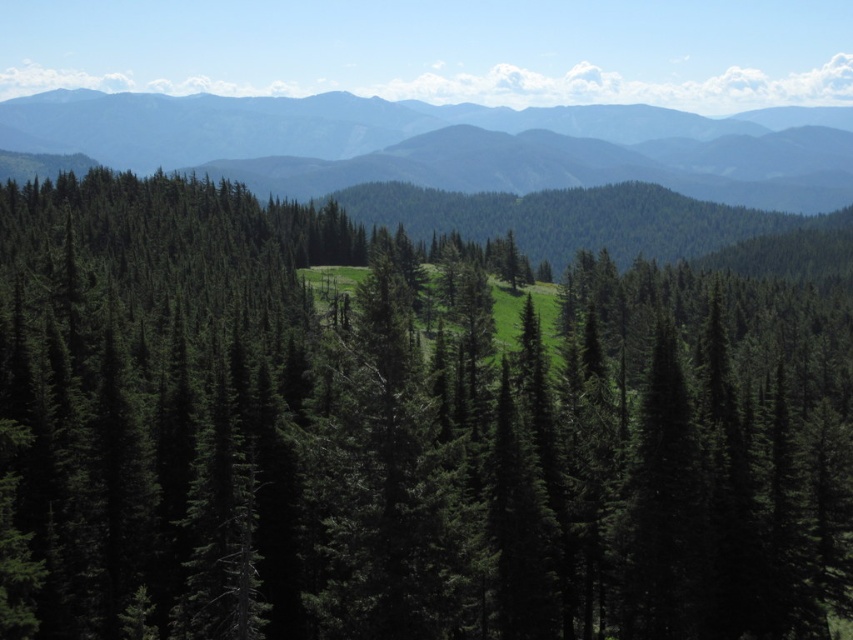
You are standing in a forest clearing and see the green matte tree at center and the green forested mountain range at upper center. Which object is closer to you?

The green matte tree at center is closer to you because it is positioned under the green forested mountain range at upper center, indicating it is in front of the mountain range.

Consider the image. You are standing in the forest and want to take a photo of the green matte tree at center and the green forested mountain range at upper center. Which object will appear wider in the photo?

The green matte tree at center appears narrower in the photo because it has a lesser width compared to the green forested mountain range at upper center.

You are standing at the origin point in the forest scene. Which direction should you walk to reach the green matte tree at center?

You should walk towards the point at coordinates 0.681 in the x direction and 0.469 in the y direction to reach the green matte tree at center.